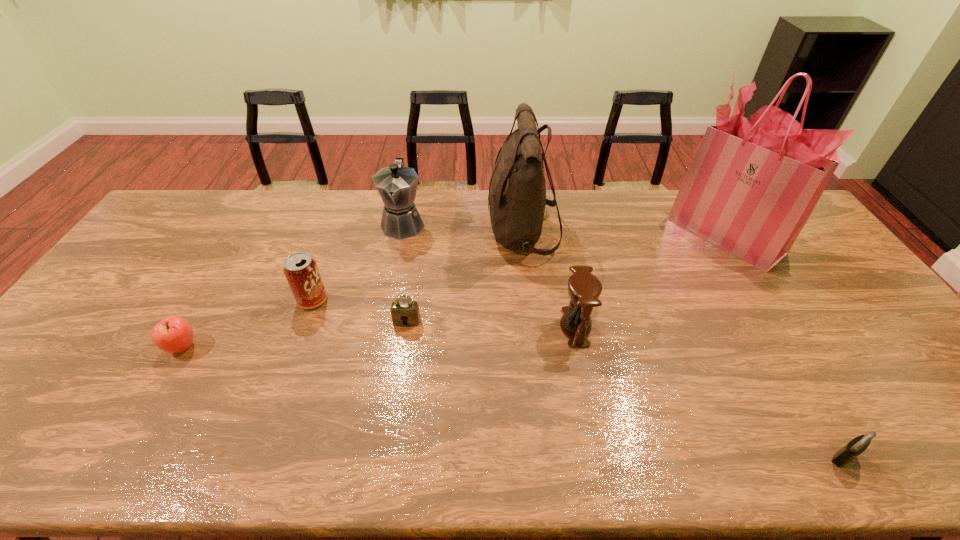
Where is `vacant region located 0.400m on the open flap of the seventh shortest object`? The image size is (960, 540). vacant region located 0.400m on the open flap of the seventh shortest object is located at coordinates (369, 232).

Where is `free space located 0.080m on the open flap of the seventh shortest object`? The image size is (960, 540). free space located 0.080m on the open flap of the seventh shortest object is located at coordinates (464, 232).

Locate an element on the screen. vacant space located on the open flap of the seventh shortest object is located at coordinates (393, 232).

Image resolution: width=960 pixels, height=540 pixels. I want to click on vacant space located 0.230m at the spout of the coffeepot, so click(x=389, y=295).

This screenshot has height=540, width=960. Find the location of `free location located 0.290m on the back of the hourglass`. free location located 0.290m on the back of the hourglass is located at coordinates (559, 241).

At what (x,y) coordinates should I click in order to perform the action: click on free space located on the front of the soda can. Please return your answer as a coordinate pair (x, y). Looking at the image, I should click on (294, 353).

Where is `vacant space located 0.260m on the right of the apple`? The image size is (960, 540). vacant space located 0.260m on the right of the apple is located at coordinates (299, 347).

Locate an element on the screen. free region located at the front of the left padlock near the keyhole is located at coordinates (390, 433).

Image resolution: width=960 pixels, height=540 pixels. Identify the location of vacant space located on the right of the right padlock. (904, 457).

This screenshot has height=540, width=960. I want to click on shopping bag positioned at the far edge, so click(751, 187).